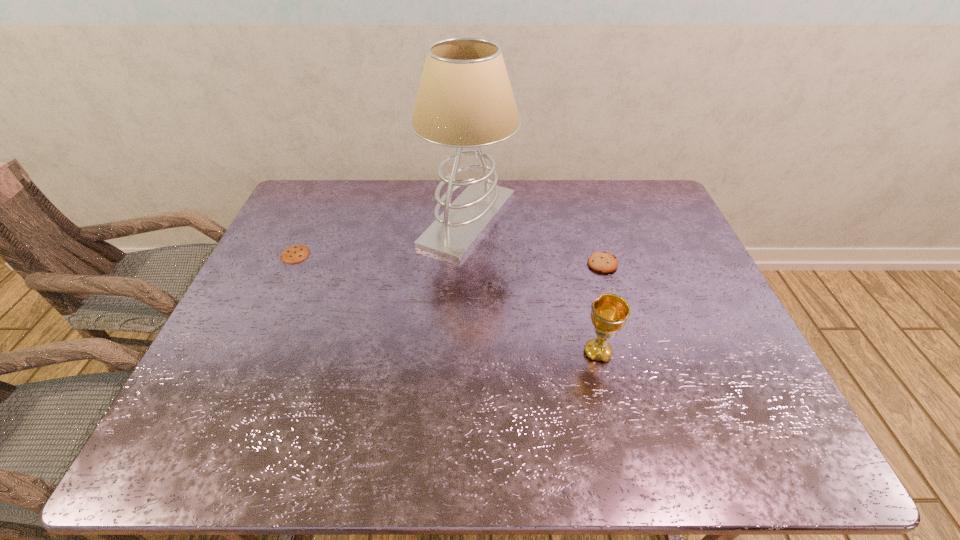
Locate an element on the screen. vacant position located on the left of the second shortest object is located at coordinates (464, 264).

Where is `free space located 0.380m on the right of the left cookie`? The width and height of the screenshot is (960, 540). free space located 0.380m on the right of the left cookie is located at coordinates (438, 254).

This screenshot has height=540, width=960. I want to click on object situated at the far edge, so click(465, 99).

You are a GUI agent. You are given a task and a screenshot of the screen. Output one action in this format:
    pyautogui.click(x=<x>, y=<y>)
    Task: Click on the object that is at the left edge
    This screenshot has width=960, height=540.
    Given the screenshot: What is the action you would take?
    pyautogui.click(x=296, y=253)

I want to click on vacant space at the far edge, so click(395, 200).

The image size is (960, 540). I want to click on vacant space at the right edge of the desktop, so click(655, 271).

The height and width of the screenshot is (540, 960). What are the coordinates of `free spot at the far left corner of the desktop` in the screenshot? It's located at [x=337, y=190].

In the image, there is a desktop. Where is `blank space at the far right corner`? blank space at the far right corner is located at coordinates (636, 193).

Where is `unoccupied area between the tallest object and the left cookie`? The width and height of the screenshot is (960, 540). unoccupied area between the tallest object and the left cookie is located at coordinates (382, 237).

Find the location of `unoccupied position between the second object from left to right and the shortest object`. unoccupied position between the second object from left to right and the shortest object is located at coordinates point(382,237).